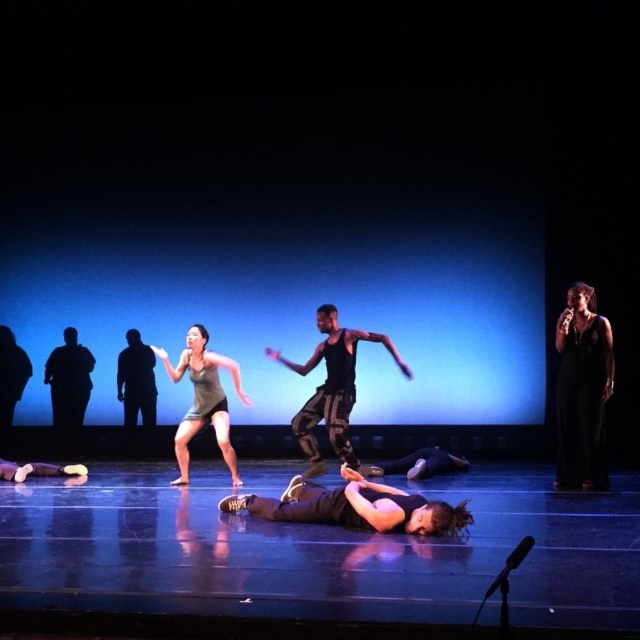
Which is below, black mesh tank top at center or black matte figure at left?

Positioned lower is black mesh tank top at center.

Identify the location of black mesh tank top at center. This screenshot has width=640, height=640. (332, 388).

Does matte gray tank top at center appear on the right side of black matte figure at left?

Correct, you'll find matte gray tank top at center to the right of black matte figure at left.

Does point (182, 353) come farther from viewer compared to point (81, 365)?

No, it is not.

You are a GUI agent. You are given a task and a screenshot of the screen. Output one action in this format:
    pyautogui.click(x=<x>, y=<y>)
    Task: Click on the matte gray tank top at center
    Image resolution: width=640 pixels, height=640 pixels.
    Given the screenshot: What is the action you would take?
    pyautogui.click(x=202, y=400)

Which of these two, black satin dress at right or black mesh tank top at center, stands taller?

With more height is black satin dress at right.

Describe the element at coordinates (582, 390) in the screenshot. I see `black satin dress at right` at that location.

Find the location of a particular element. Image resolution: width=640 pixels, height=640 pixels. black satin dress at right is located at coordinates (582, 390).

Locate an element on the screen. black satin dress at right is located at coordinates [x=582, y=390].